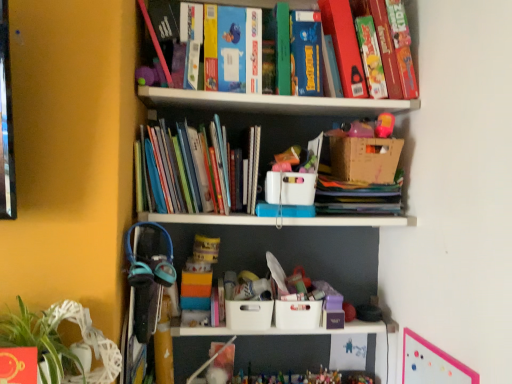
Question: Is pink matte bulletin board at upper right aimed at hardcover book at upper right, the 2th book from the bottom?

Choices:
 (A) yes
 (B) no

Answer: (B)

Question: Is hardcover book at upper right, the 2th book from the bottom, at the back of pink matte bulletin board at upper right?

Choices:
 (A) no
 (B) yes

Answer: (A)

Question: Does pink matte bulletin board at upper right appear on the left side of hardcover book at upper right, the 1th book in the top-to-bottom sequence?

Choices:
 (A) yes
 (B) no

Answer: (B)

Question: Is hardcover book at upper right, marked as the first book in a right-to-left arrangement, a part of pink matte bulletin board at upper right?

Choices:
 (A) no
 (B) yes

Answer: (A)

Question: Does pink matte bulletin board at upper right have a larger size compared to hardcover book at upper right, the 2th book from the bottom?

Choices:
 (A) no
 (B) yes

Answer: (A)

Question: Is hardcover book at upper right, the 1th book in the top-to-bottom sequence, wider or thinner than white plastic storage box at lower center, acting as the 2th storage box starting from the top?

Choices:
 (A) wide
 (B) thin

Answer: (A)

Question: Looking at the image, does hardcover book at upper right, marked as the first book in a right-to-left arrangement, seem bigger or smaller compared to white plastic storage box at lower center, which is the 2th storage box from bottom to top?

Choices:
 (A) big
 (B) small

Answer: (A)

Question: From a real-world perspective, relative to white plastic storage box at lower center, which is the 2th storage box from bottom to top, is hardcover book at upper right, the 1th book in the top-to-bottom sequence, vertically above or below?

Choices:
 (A) below
 (B) above

Answer: (B)

Question: Is hardcover book at upper right, marked as the first book in a right-to-left arrangement, to the left or to the right of white plastic storage box at lower center, which is the 2th storage box from bottom to top, in the image?

Choices:
 (A) right
 (B) left

Answer: (A)

Question: Considering the positions of point (239, 326) and point (407, 379), is point (239, 326) closer or farther from the camera than point (407, 379)?

Choices:
 (A) farther
 (B) closer

Answer: (A)

Question: Is white plastic storage box at lower center, which is the 2th storage box from bottom to top, in front of or behind pink matte bulletin board at upper right in the image?

Choices:
 (A) behind
 (B) front

Answer: (A)

Question: From the image's perspective, relative to pink matte bulletin board at upper right, is white plastic storage box at lower center, which is the 2th storage box from bottom to top, above or below?

Choices:
 (A) below
 (B) above

Answer: (B)

Question: Is white plastic storage box at lower center, acting as the 2th storage box starting from the top, taller or shorter than pink matte bulletin board at upper right?

Choices:
 (A) short
 (B) tall

Answer: (A)

Question: In terms of size, does white wicker swivel chair at lower left appear bigger or smaller than hardcover book at upper right, the 2th book from the bottom?

Choices:
 (A) big
 (B) small

Answer: (B)

Question: Choose the correct answer: Is white wicker swivel chair at lower left inside hardcover book at upper right, the second book in the left-to-right sequence, or outside it?

Choices:
 (A) inside
 (B) outside

Answer: (B)